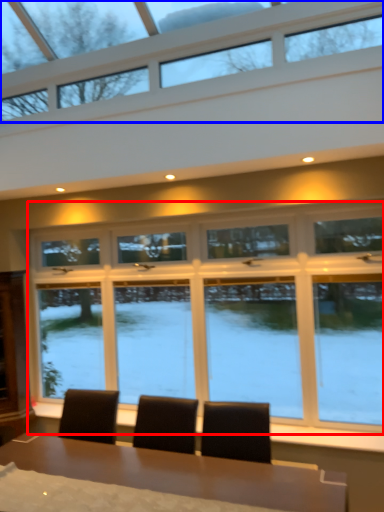
Question: Which object is further to the camera taking this photo, window (highlighted by a red box) or window (highlighted by a blue box)?

Choices:
 (A) window
 (B) window

Answer: (A)